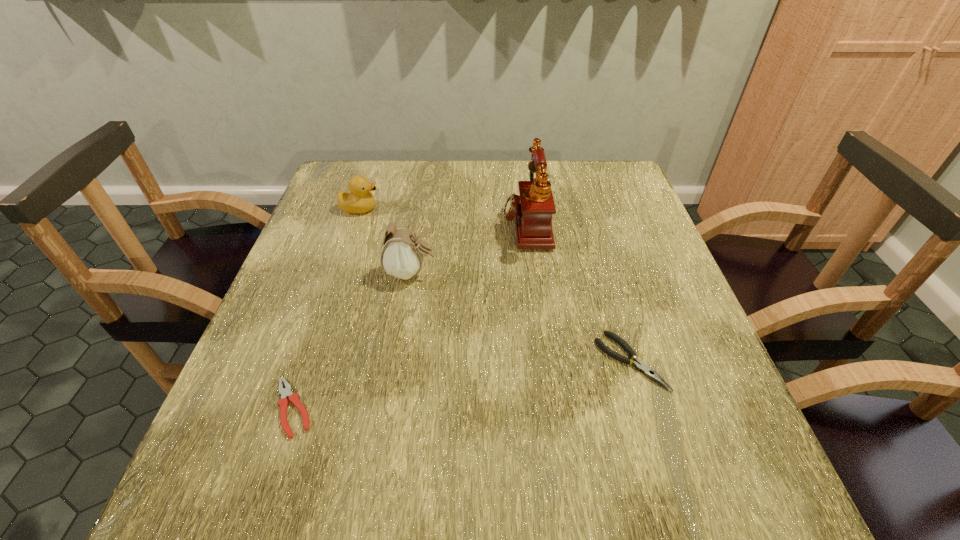
Where is `blank area located 0.310m on the dial of the fourth object from left to right`? blank area located 0.310m on the dial of the fourth object from left to right is located at coordinates (382, 224).

At what (x,y) coordinates should I click in order to perform the action: click on vacant position located 0.340m on the dial of the fourth object from left to right. Please return your answer as a coordinate pair (x, y). Looking at the image, I should click on (371, 224).

In order to click on free space located on the front-facing side of the third object from left to right in this screenshot , I will do `click(546, 273)`.

You are a GUI agent. You are given a task and a screenshot of the screen. Output one action in this format:
    pyautogui.click(x=<x>, y=<y>)
    Task: Click on the vacant space positioned on the face of the third tallest object
    The image size is (960, 540).
    Given the screenshot: What is the action you would take?
    pyautogui.click(x=499, y=208)

At what (x,y) coordinates should I click in order to perform the action: click on vacant position located on the left of the rightmost object. Please return your answer as a coordinate pair (x, y). The height and width of the screenshot is (540, 960). Looking at the image, I should click on (498, 361).

This screenshot has height=540, width=960. What are the coordinates of `vacant point located on the back of the shorter pliers` in the screenshot? It's located at (338, 274).

In order to click on telephone that is positioned at the far edge in this screenshot , I will do `click(533, 208)`.

Locate an element on the screen. The image size is (960, 540). duckling located at the far edge is located at coordinates (359, 200).

Locate an element on the screen. The height and width of the screenshot is (540, 960). duckling positioned at the left edge is located at coordinates (359, 200).

You are a GUI agent. You are given a task and a screenshot of the screen. Output one action in this format:
    pyautogui.click(x=<x>, y=<y>)
    Task: Click on the pliers that is at the left edge
    The height and width of the screenshot is (540, 960).
    Given the screenshot: What is the action you would take?
    pyautogui.click(x=286, y=392)